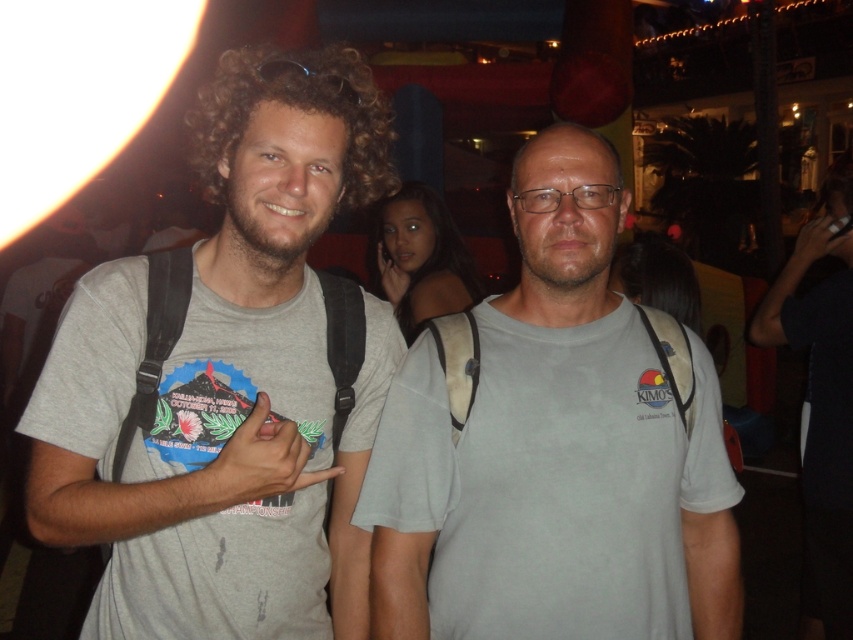
Is gray cotton t-shirt at left closer to the viewer compared to gray cotton t-shirt at center?

Yes, it is in front of gray cotton t-shirt at center.

How much distance is there between gray cotton t-shirt at left and gray cotton t-shirt at center?

gray cotton t-shirt at left and gray cotton t-shirt at center are 37.20 centimeters apart.

Identify the location of gray cotton t-shirt at left. (228, 380).